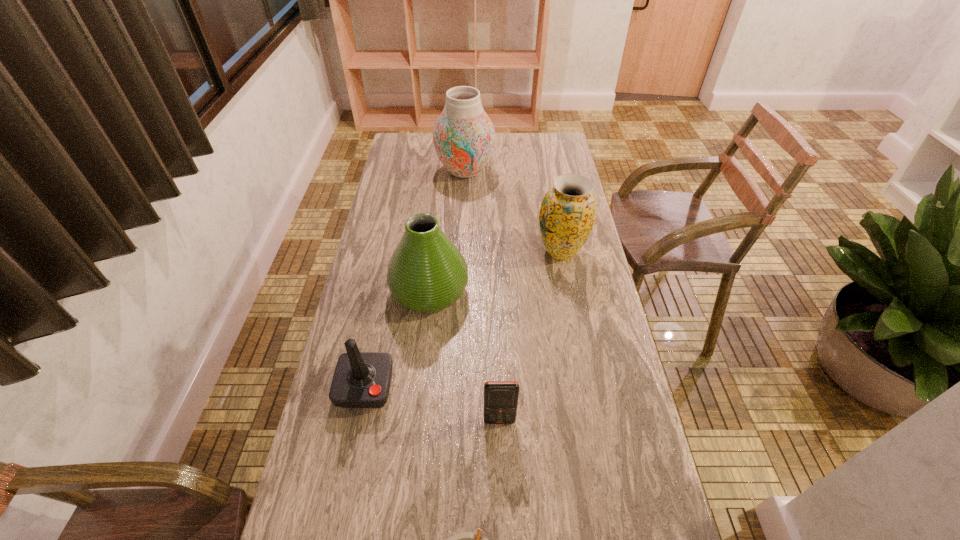
You are a GUI agent. You are given a task and a screenshot of the screen. Output one action in this format:
    pyautogui.click(x=<x>, y=<y>)
    Task: Click on the tallest vase
    This screenshot has height=540, width=960.
    Given the screenshot: What is the action you would take?
    pyautogui.click(x=464, y=137)

Where is `the farthest vase`? The image size is (960, 540). the farthest vase is located at coordinates (464, 137).

Where is `the rightmost vase`? This screenshot has width=960, height=540. the rightmost vase is located at coordinates (567, 215).

Identify the location of joystick. This screenshot has height=540, width=960. (361, 379).

Locate an element on the screen. The width and height of the screenshot is (960, 540). cellular telephone is located at coordinates (500, 397).

This screenshot has width=960, height=540. What are the coordinates of `free spot located on the back of the farthest object` in the screenshot? It's located at (467, 132).

Identify the location of free spot located 0.210m on the back of the rightmost object. (551, 200).

The height and width of the screenshot is (540, 960). In order to click on vacant position located 0.120m on the front of the fourth farthest object in this screenshot , I will do `click(350, 460)`.

At what (x,y) coordinates should I click in order to perform the action: click on free location located 0.130m on the screen of the second nearest object. Please return your answer as a coordinate pair (x, y). The width and height of the screenshot is (960, 540). Looking at the image, I should click on click(501, 478).

The width and height of the screenshot is (960, 540). I want to click on object that is at the far edge, so click(x=464, y=137).